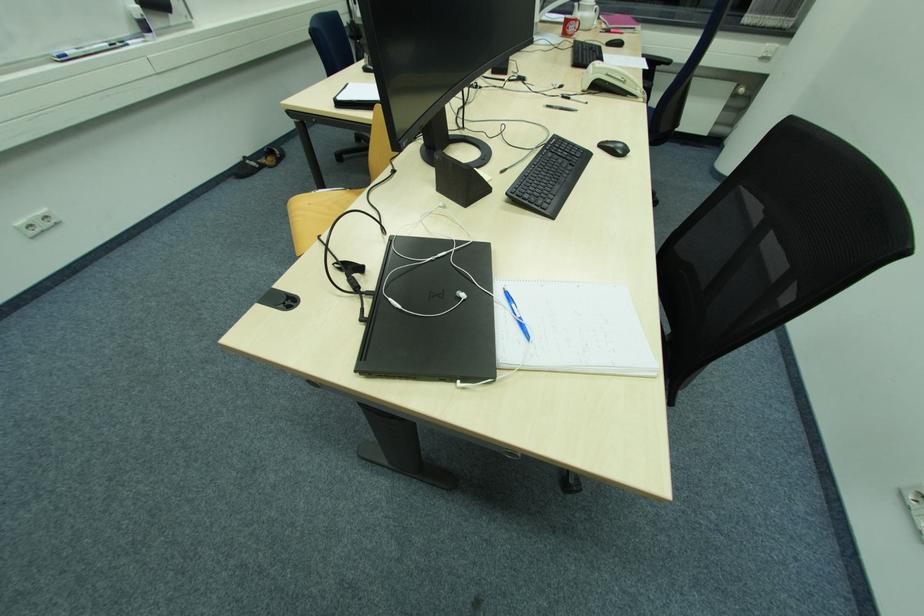
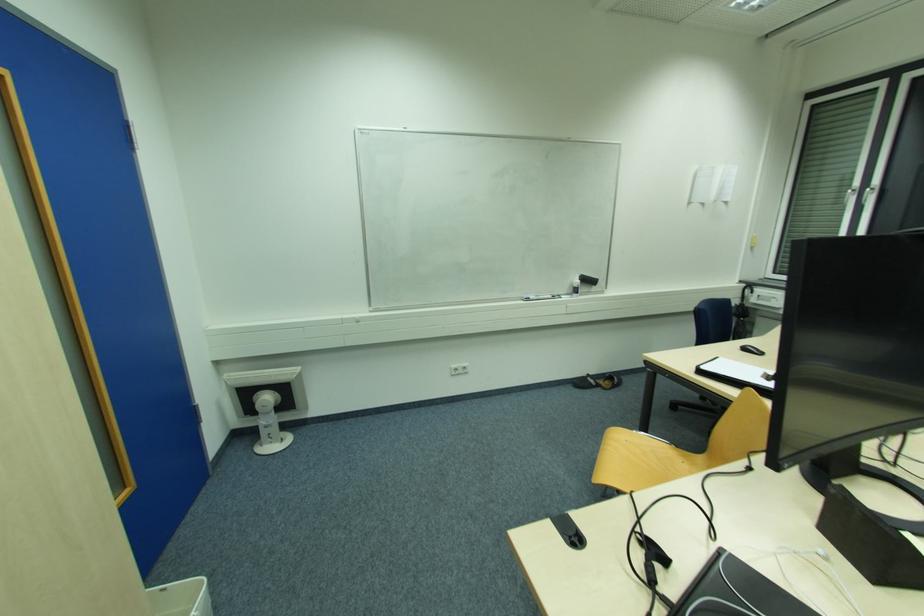
Where in the second image is the point corresponding to [311,205] from the first image?

(628, 442)